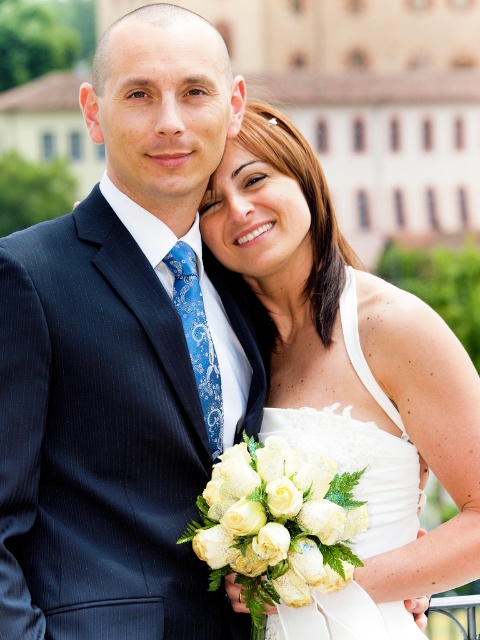
Question: Can you confirm if white satin dress at center is positioned to the left of white silk bouquet at center?

Choices:
 (A) no
 (B) yes

Answer: (A)

Question: Considering the relative positions of matte black suit at left and white satin dress at center in the image provided, where is matte black suit at left located with respect to white satin dress at center?

Choices:
 (A) right
 (B) left

Answer: (B)

Question: Based on their relative distances, which object is farther from the matte black suit at left?

Choices:
 (A) white silk bouquet at center
 (B) white satin dress at center

Answer: (A)

Question: Considering the real-world distances, which object is farthest from the matte black suit at left?

Choices:
 (A) white silk bouquet at center
 (B) white satin dress at center

Answer: (A)

Question: Which point is farther to the camera?

Choices:
 (A) click(196, 192)
 (B) click(328, 390)

Answer: (A)

Question: Is matte black suit at left to the right of white silk bouquet at center from the viewer's perspective?

Choices:
 (A) no
 (B) yes

Answer: (A)